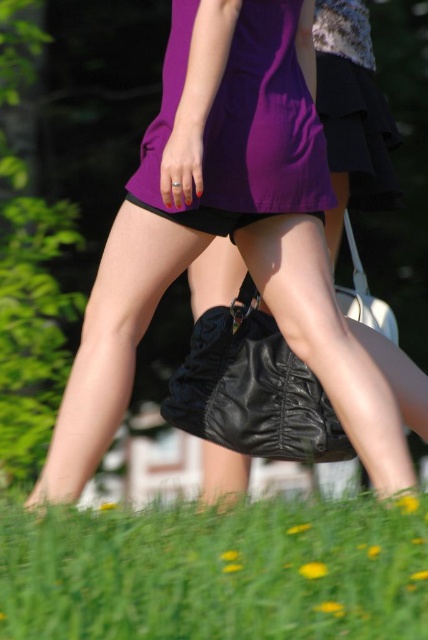
Question: From the image, what is the correct spatial relationship of green grass at lower center in relation to purple satin dress at center?

Choices:
 (A) above
 (B) below

Answer: (B)

Question: Does green grass at lower center have a greater width compared to purple satin dress at center?

Choices:
 (A) yes
 (B) no

Answer: (A)

Question: Does green grass at lower center have a larger size compared to purple satin dress at center?

Choices:
 (A) no
 (B) yes

Answer: (A)

Question: Which point is farther to the camera?

Choices:
 (A) green grass at lower center
 (B) purple satin dress at center

Answer: (B)

Question: Among these objects, which one is farthest from the camera?

Choices:
 (A) green grass at lower center
 (B) purple satin dress at center

Answer: (B)